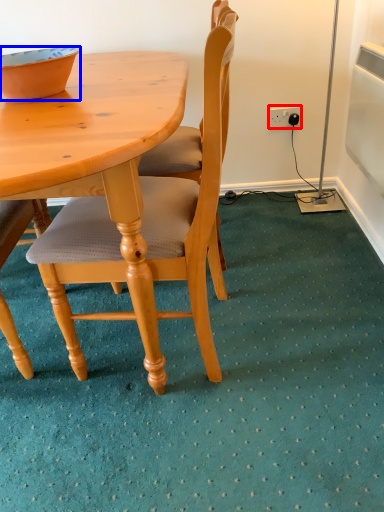
Question: Which point is closer to the camera, power outlet (highlighted by a red box) or bowl (highlighted by a blue box)?

Choices:
 (A) power outlet
 (B) bowl

Answer: (B)